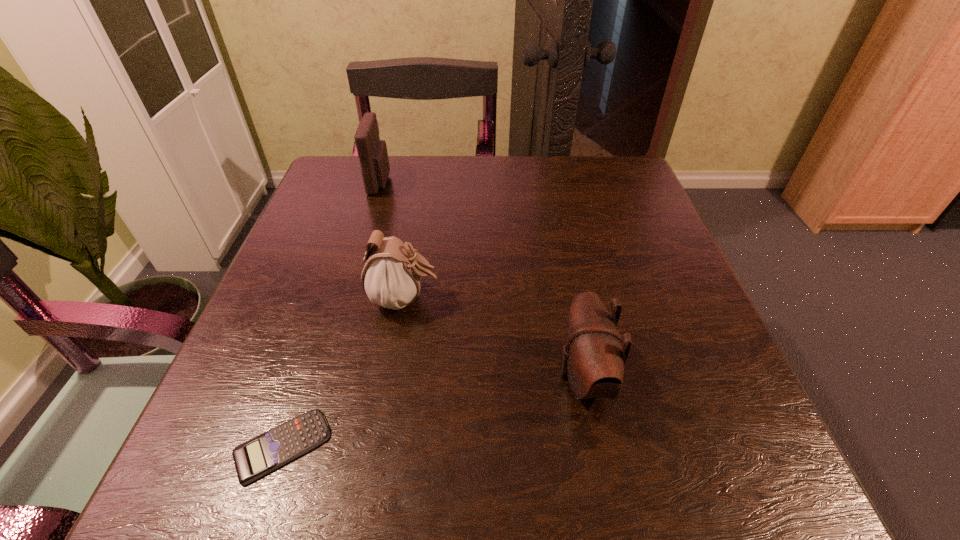
The height and width of the screenshot is (540, 960). In order to click on free space between the farthest pouch and the rightmost object in this screenshot , I will do `click(482, 279)`.

Find the location of a particular element. The width and height of the screenshot is (960, 540). free spot between the third object from left to right and the calculator is located at coordinates pyautogui.click(x=343, y=373).

The width and height of the screenshot is (960, 540). Identify the location of free spot between the third object from left to right and the rightmost pouch. (494, 338).

I want to click on free spot between the shortest object and the rightmost pouch, so click(x=433, y=411).

Identify the location of empty space that is in between the shortest object and the rightmost pouch. The height and width of the screenshot is (540, 960). (433, 411).

Where is `object that can be found as the second closest to the leftmost pouch`? object that can be found as the second closest to the leftmost pouch is located at coordinates (595, 361).

Find the location of `object that is the second nearest to the second object from right to left`. object that is the second nearest to the second object from right to left is located at coordinates (595, 361).

Image resolution: width=960 pixels, height=540 pixels. In order to click on pouch that is the closest to the leftmost pouch in this screenshot , I will do `click(391, 277)`.

Identify which pouch is located as the nearest to the second pouch from right to left. Please provide its 2D coordinates. Your answer should be formatted as a tuple, i.e. [(x, y)], where the tuple contains the x and y coordinates of a point satisfying the conditions above.

[(595, 361)]

The image size is (960, 540). I want to click on free spot that satisfies the following two spatial constraints: 1. with the flap open on the nearest pouch; 2. on the front side of the shortest object, so click(598, 446).